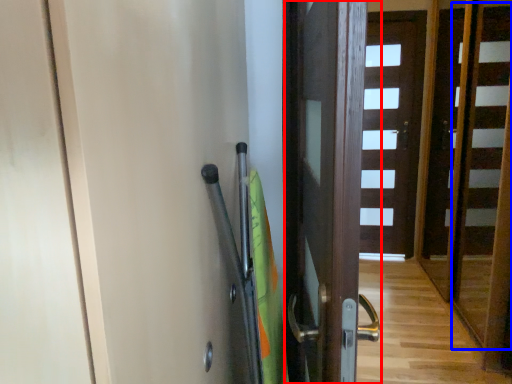
Question: Which of the following is the farthest to the observer, door (highlighted by a red box) or stair (highlighted by a blue box)?

Choices:
 (A) door
 (B) stair

Answer: (B)